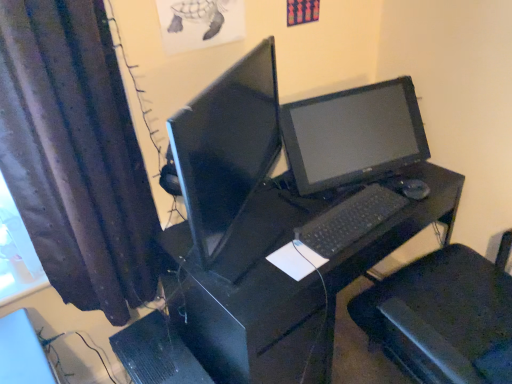
At what (x,y) coordinates should I click in order to perform the action: click on vacant space underneath black matte keyboard at center (from a real-world perspective). Please return your answer as a coordinate pair (x, y). The width and height of the screenshot is (512, 384). Looking at the image, I should click on (342, 218).